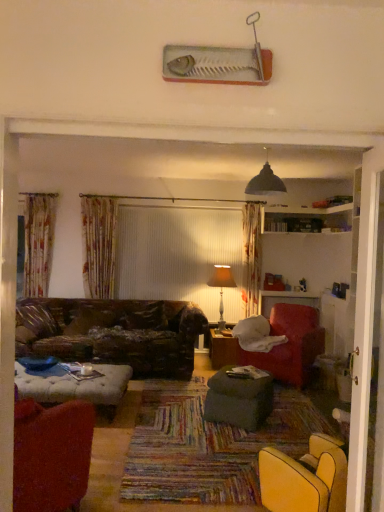
Question: Relative to wooden table at center, acting as the second table starting from the front, is black matte lampshade at upper center in front or behind?

Choices:
 (A) behind
 (B) front

Answer: (B)

Question: From a real-world perspective, is black matte lampshade at upper center positioned above or below wooden table at center, acting as the 1th table starting from the back?

Choices:
 (A) above
 (B) below

Answer: (A)

Question: Considering the real-world distances, which object is farthest from the velvet red armchair at lower left, marked as the first chair in a left-to-right arrangement?

Choices:
 (A) velvet red armchair at right, acting as the 1th chair starting from the back
 (B) black matte lampshade at upper center
 (C) wooden table at center, acting as the second table starting from the front
 (D) matte beige lampshade at center
 (E) dark green fabric ottoman at center, which is counted as the first table, starting from the front

Answer: (D)

Question: Which is farther from the matte beige lampshade at center?

Choices:
 (A) black matte lampshade at upper center
 (B) dark green fabric ottoman at center, which appears as the second table when viewed from the back
 (C) velvet red armchair at right, arranged as the first chair when viewed from the right
 (D) velvet red armchair at lower left, the first chair in the front-to-back sequence
 (E) wooden table at center, acting as the second table starting from the front

Answer: (D)